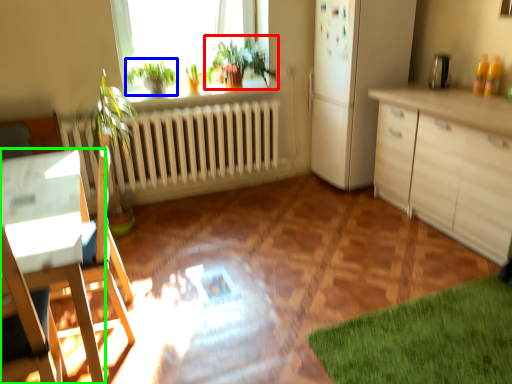
Question: Based on their relative distances, which object is nearer to houseplant (highlighted by a red box)? Choose from plant (highlighted by a blue box) and desk (highlighted by a green box).

Choices:
 (A) plant
 (B) desk

Answer: (A)